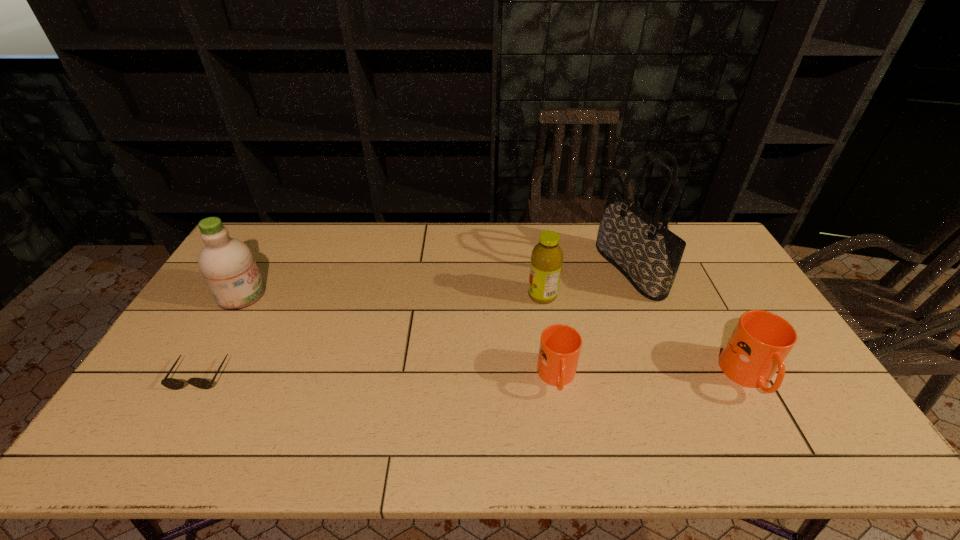
Find the location of a particular element. This screenshot has height=540, width=960. vacant area located on the back of the tallest object is located at coordinates click(611, 224).

I want to click on free space located 0.400m on the front label of the fourth shortest object, so click(x=402, y=295).

You are a GUI agent. You are given a task and a screenshot of the screen. Output one action in this format:
    pyautogui.click(x=<x>, y=<y>)
    Task: Click on the vacant area situated 0.090m on the front label of the fourth shortest object
    Image resolution: width=960 pixels, height=540 pixels.
    Given the screenshot: What is the action you would take?
    pyautogui.click(x=499, y=295)

The width and height of the screenshot is (960, 540). I want to click on free space located 0.150m on the front label of the fourth shortest object, so click(x=480, y=295).

Find the location of `vacant space located 0.080m on the front-facing side of the sunglasses`. vacant space located 0.080m on the front-facing side of the sunglasses is located at coordinates (175, 418).

Locate an element on the screen. This screenshot has height=540, width=960. object present at the far edge is located at coordinates (647, 253).

You are a GUI agent. You are given a task and a screenshot of the screen. Output one action in this format:
    pyautogui.click(x=<x>, y=<y>)
    Task: Click on the sunglasses present at the near edge
    This screenshot has height=540, width=960.
    Given the screenshot: What is the action you would take?
    (x=171, y=383)

At what (x,y) coordinates should I click in order to perform the action: click on cleansing agent that is at the left edge. Please return your answer as a coordinate pair (x, y). Looking at the image, I should click on (227, 264).

The image size is (960, 540). I want to click on sunglasses that is positioned at the left edge, so click(x=171, y=383).

Find the location of a particular element. The width and height of the screenshot is (960, 540). object that is at the right edge is located at coordinates (760, 342).